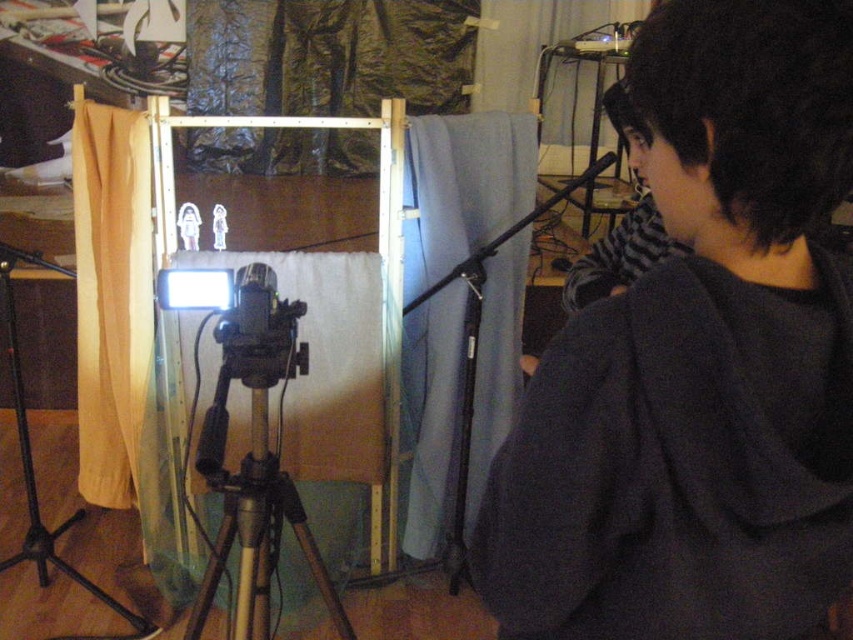
Does dark gray hoodie at upper right have a greater height compared to satin black camera at center?

Yes.

The image size is (853, 640). What do you see at coordinates (699, 364) in the screenshot?
I see `dark gray hoodie at upper right` at bounding box center [699, 364].

The width and height of the screenshot is (853, 640). I want to click on dark gray hoodie at upper right, so click(699, 364).

Where is `dark gray hoodie at upper right`? dark gray hoodie at upper right is located at coordinates (699, 364).

Looking at this image, who is shorter, wooden tripod at center or black matte tripod at lower left?

Standing shorter between the two is wooden tripod at center.

Does wooden tripod at center have a greater height compared to black matte tripod at lower left?

No.

Between point (224, 376) and point (15, 374), which one is positioned in front?

Positioned in front is point (224, 376).

Image resolution: width=853 pixels, height=640 pixels. Identify the location of wooden tripod at center. (254, 509).

Is dark gray hoodie at upper right bigger than black matte tripod at lower left?

Actually, dark gray hoodie at upper right might be smaller than black matte tripod at lower left.

Is dark gray hoodie at upper right to the right of black matte tripod at lower left from the viewer's perspective?

Indeed, dark gray hoodie at upper right is positioned on the right side of black matte tripod at lower left.

The height and width of the screenshot is (640, 853). Identify the location of dark gray hoodie at upper right. (699, 364).